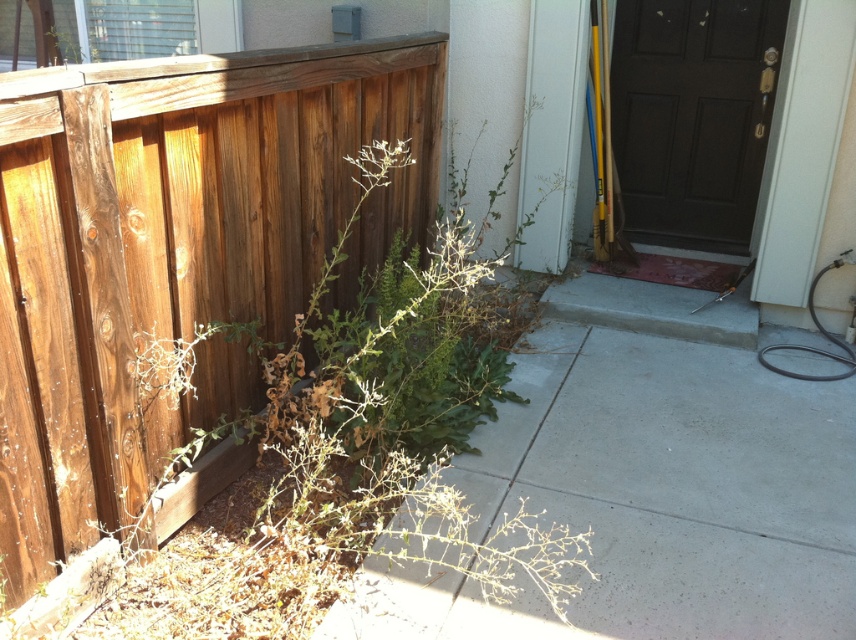
You are standing in the residential outdoor area shown and need to access the gate. The weathered wood fence at left is in your way. Can you walk around it to reach the gate on the other side?

The weathered wood fence at left is located at point (175, 252), which means it is positioned on the left side of the area. Since fences typically have gates, you can walk around the fence to the left or right to find the gate and access the other side.

You are standing in the residential outdoor area shown in the image. You notice two points marked in the scene. The first point is at coordinate point (147, 298) and the second is at point (841, 378). Which of these points is nearer to your current position?

Point (147, 298) is closer to the camera than point (841, 378), so the first point is nearer to your current position.